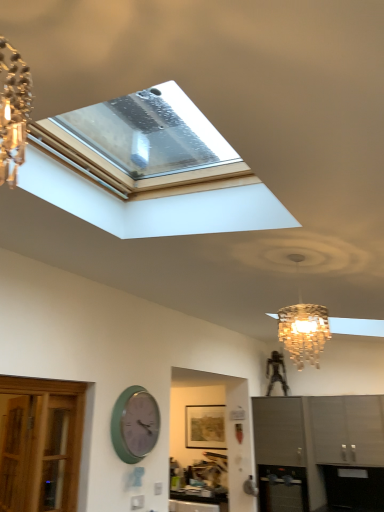
Question: Should I look upward or downward to see matte gray cabinet at lower right, marked as the 2th cabinetry in a right-to-left arrangement?

Choices:
 (A) down
 (B) up

Answer: (A)

Question: From the image's perspective, is metallic stainless steel oven at lower center on top of green matte wall clock at lower left?

Choices:
 (A) yes
 (B) no

Answer: (B)

Question: Considering the relative sizes of metallic stainless steel oven at lower center and green matte wall clock at lower left in the image provided, is metallic stainless steel oven at lower center wider than green matte wall clock at lower left?

Choices:
 (A) yes
 (B) no

Answer: (A)

Question: From a real-world perspective, does metallic stainless steel oven at lower center stand above green matte wall clock at lower left?

Choices:
 (A) yes
 (B) no

Answer: (B)

Question: Is the position of metallic stainless steel oven at lower center less distant than that of green matte wall clock at lower left?

Choices:
 (A) yes
 (B) no

Answer: (B)

Question: Would you say metallic stainless steel oven at lower center is outside green matte wall clock at lower left?

Choices:
 (A) yes
 (B) no

Answer: (A)

Question: Does metallic stainless steel oven at lower center touch green matte wall clock at lower left?

Choices:
 (A) yes
 (B) no

Answer: (B)

Question: From a real-world perspective, is satin gray cabinet at lower right, which is counted as the first cabinetry, starting from the right, on top of metallic stainless steel oven at lower center?

Choices:
 (A) no
 (B) yes

Answer: (B)

Question: Considering the relative sizes of satin gray cabinet at lower right, which is the second cabinetry from left to right, and metallic stainless steel oven at lower center in the image provided, is satin gray cabinet at lower right, which is the second cabinetry from left to right, smaller than metallic stainless steel oven at lower center?

Choices:
 (A) no
 (B) yes

Answer: (A)

Question: Could metallic stainless steel oven at lower center be considered to be inside satin gray cabinet at lower right, which is the second cabinetry from left to right?

Choices:
 (A) yes
 (B) no

Answer: (B)

Question: From the image's perspective, is satin gray cabinet at lower right, which is counted as the first cabinetry, starting from the right, over metallic stainless steel oven at lower center?

Choices:
 (A) yes
 (B) no

Answer: (A)

Question: Is satin gray cabinet at lower right, which is counted as the first cabinetry, starting from the right, in contact with metallic stainless steel oven at lower center?

Choices:
 (A) yes
 (B) no

Answer: (B)

Question: Is satin gray cabinet at lower right, which is the second cabinetry from left to right, at the right side of metallic stainless steel oven at lower center?

Choices:
 (A) no
 (B) yes

Answer: (B)

Question: Is green matte wall clock at lower left positioned behind matte gray cabinet at lower right, marked as the 2th cabinetry in a right-to-left arrangement?

Choices:
 (A) no
 (B) yes

Answer: (A)